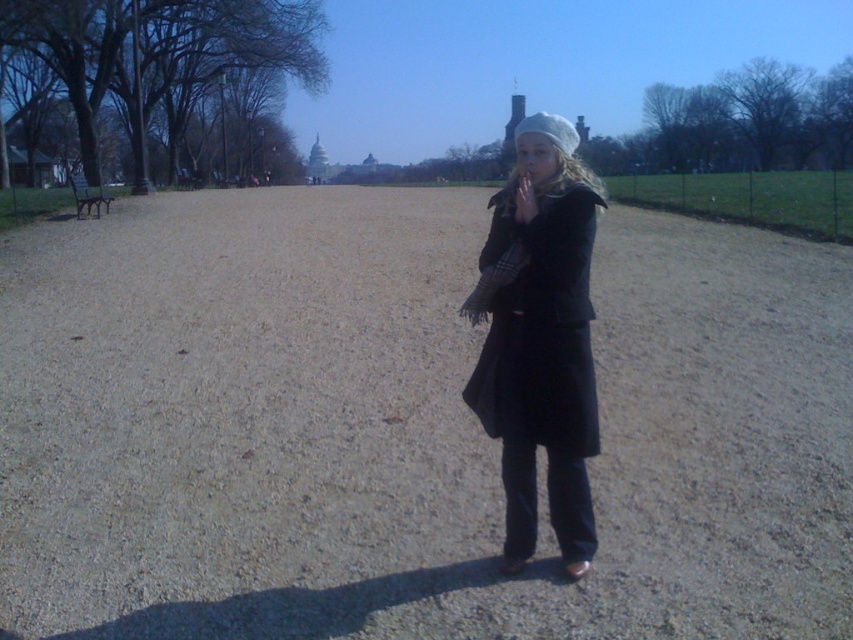
Question: Estimate the real-world distances between objects in this image. Which object is farther from the dirt/gravel path at center?

Choices:
 (A) matte black hand at center
 (B) matte black coat at center

Answer: (A)

Question: Which object is positioned closest to the dirt/gravel path at center?

Choices:
 (A) matte black hand at center
 (B) matte black coat at center

Answer: (B)

Question: Can you confirm if dirt/gravel path at center is positioned below matte black coat at center?

Choices:
 (A) no
 (B) yes

Answer: (A)

Question: Where is dirt/gravel path at center located in relation to matte black coat at center in the image?

Choices:
 (A) below
 (B) above

Answer: (B)

Question: Which point is farther to the camera?

Choices:
 (A) matte black coat at center
 (B) matte black hand at center
 (C) dirt/gravel path at center

Answer: (A)

Question: Is dirt/gravel path at center closer to camera compared to matte black coat at center?

Choices:
 (A) no
 (B) yes

Answer: (B)